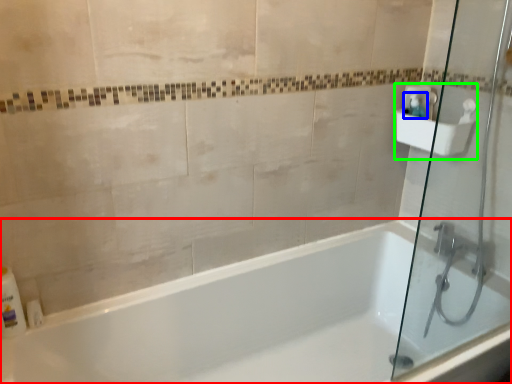
Question: Estimate the real-world distances between objects in this image. Which object is farther from bathtub (highlighted by a red box), soap dispenser (highlighted by a blue box) or sink (highlighted by a green box)?

Choices:
 (A) soap dispenser
 (B) sink

Answer: (A)